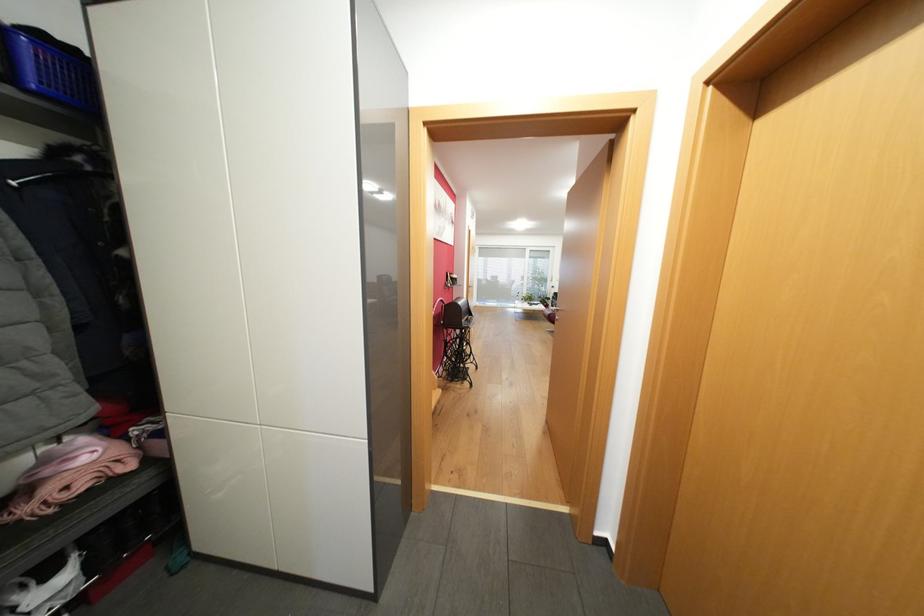
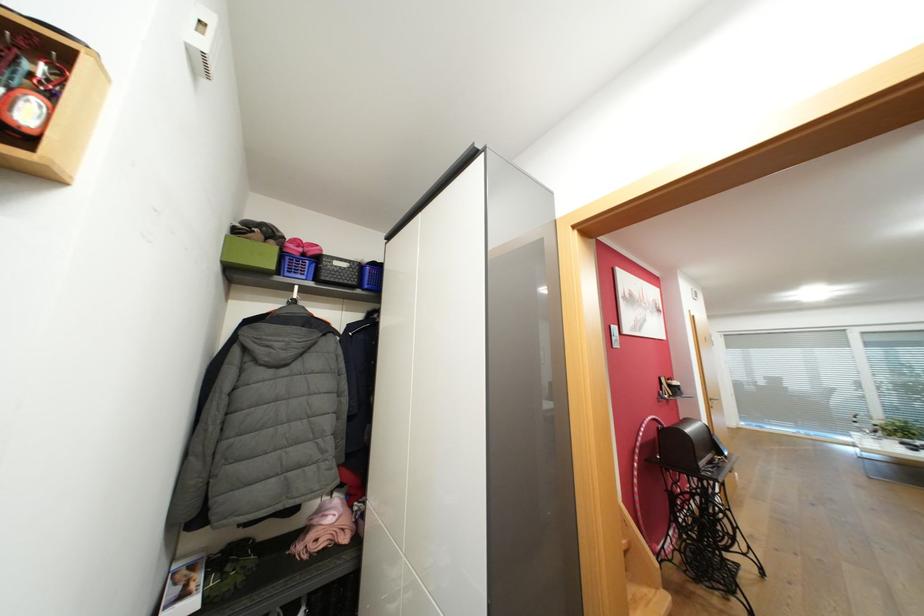
Locate, in the second image, the point that corresponds to (x=447, y=301) in the first image.

(661, 419)